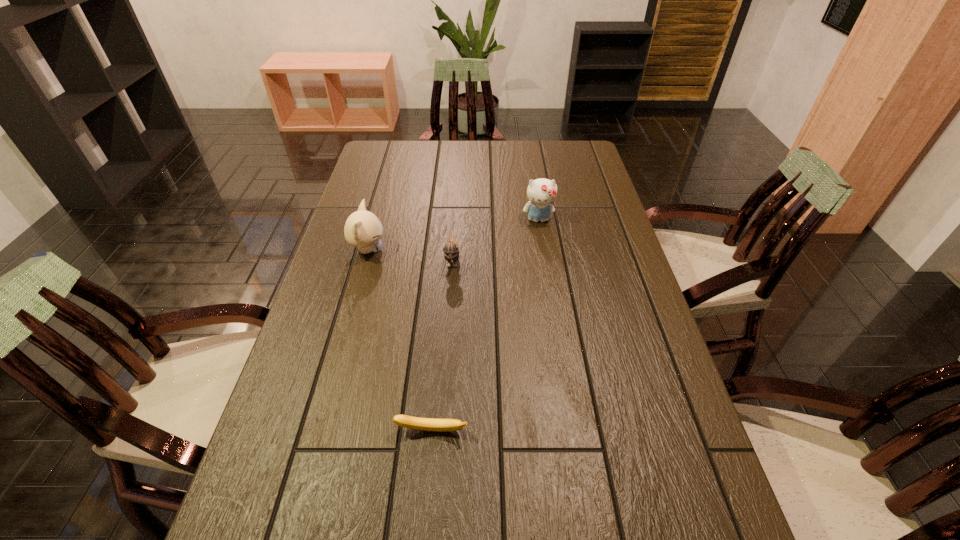
Where is `vacant space located at the stem of the shortest object`? Image resolution: width=960 pixels, height=540 pixels. vacant space located at the stem of the shortest object is located at coordinates (429, 462).

Where is `object located at the left edge`? This screenshot has height=540, width=960. object located at the left edge is located at coordinates (x=363, y=229).

At what (x,y) coordinates should I click in order to perform the action: click on blank space at the far edge. Please return your answer as a coordinate pair (x, y). Looking at the image, I should click on (536, 166).

Find the location of a particular element. This screenshot has height=540, width=960. vacant space at the left edge is located at coordinates (386, 226).

In the image, there is a desktop. Where is `blank space at the right edge`? The image size is (960, 540). blank space at the right edge is located at coordinates (618, 345).

Find the location of a particular element. free spot at the far left corner of the desktop is located at coordinates (404, 165).

Locate an element on the screen. The height and width of the screenshot is (540, 960). vacant area at the far right corner is located at coordinates (591, 168).

The width and height of the screenshot is (960, 540). I want to click on empty location between the rightmost object and the shortest kitten, so click(x=495, y=239).

Where is `free space between the farthest object and the second kitten from right to left`? free space between the farthest object and the second kitten from right to left is located at coordinates [495, 239].

The image size is (960, 540). In order to click on free space between the banana and the rightmost kitten in this screenshot , I will do pyautogui.click(x=485, y=325).